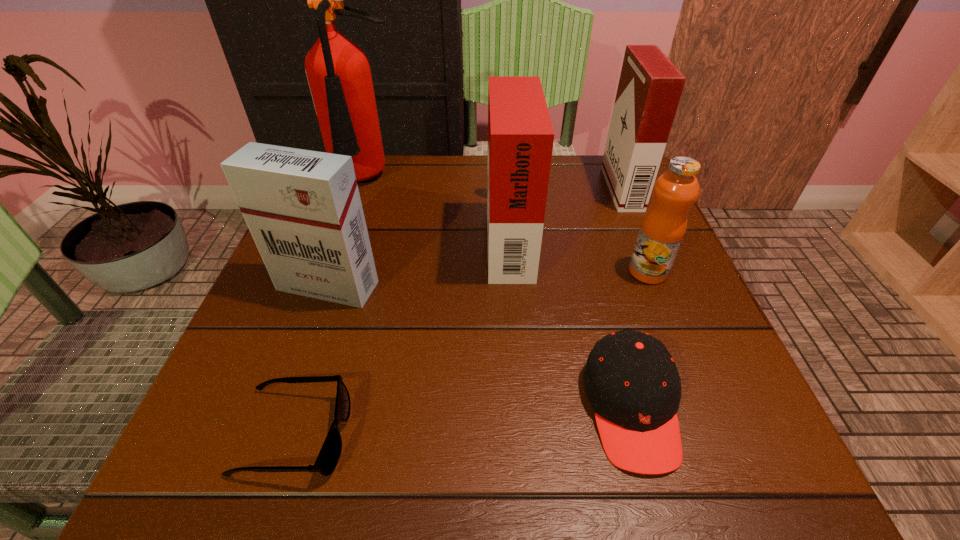
Locate an element on the screen. vacant space located 0.270m on the front-facing side of the fourth object from right to left is located at coordinates point(358,237).

Locate an element on the screen. The height and width of the screenshot is (540, 960). vacant space located 0.320m on the front-facing side of the fourth object from right to left is located at coordinates click(335, 237).

This screenshot has height=540, width=960. What are the coordinates of `vacant area situated on the front-facing side of the rightmost cigarette case` in the screenshot? It's located at (492, 189).

The image size is (960, 540). In order to click on free region located 0.100m on the front-facing side of the rightmost cigarette case in this screenshot , I will do `click(567, 189)`.

Where is `free space located 0.140m on the front-facing side of the rightmost cigarette case`? The width and height of the screenshot is (960, 540). free space located 0.140m on the front-facing side of the rightmost cigarette case is located at coordinates (550, 189).

Locate an element on the screen. Image resolution: width=960 pixels, height=540 pixels. free region located on the front of the leftmost cigarette case is located at coordinates (309, 340).

Where is `vacant space located 0.180m on the left of the fruit juice`? vacant space located 0.180m on the left of the fruit juice is located at coordinates (535, 272).

The width and height of the screenshot is (960, 540). I want to click on free space located on the front-facing side of the sunglasses, so click(397, 434).

You are a GUI agent. You are given a task and a screenshot of the screen. Output one action in this format:
    pyautogui.click(x=<x>, y=<y>)
    Task: Click on the fire extinguisher that is at the far edge
    The image size is (960, 540).
    Given the screenshot: What is the action you would take?
    pyautogui.click(x=338, y=71)

At what (x,y) coordinates should I click in order to perform the action: click on cap that is at the near edge. Please return your answer as a coordinate pair (x, y). Image resolution: width=960 pixels, height=540 pixels. Looking at the image, I should click on (631, 380).